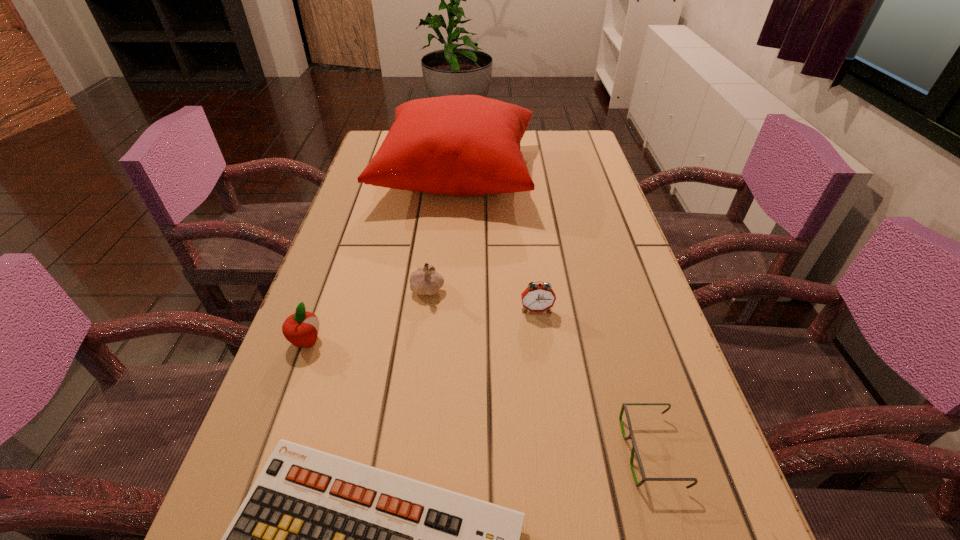
Find the location of `blank space that satisfies the following two spatial constraints: 1. on the back side of the third nearest object; 2. on the right side of the farthest object`. blank space that satisfies the following two spatial constraints: 1. on the back side of the third nearest object; 2. on the right side of the farthest object is located at coordinates (368, 174).